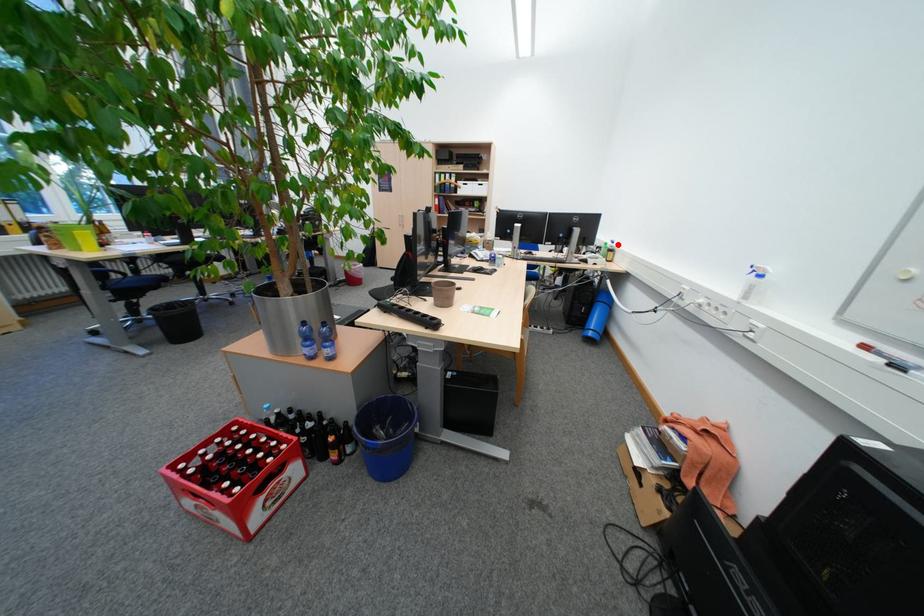
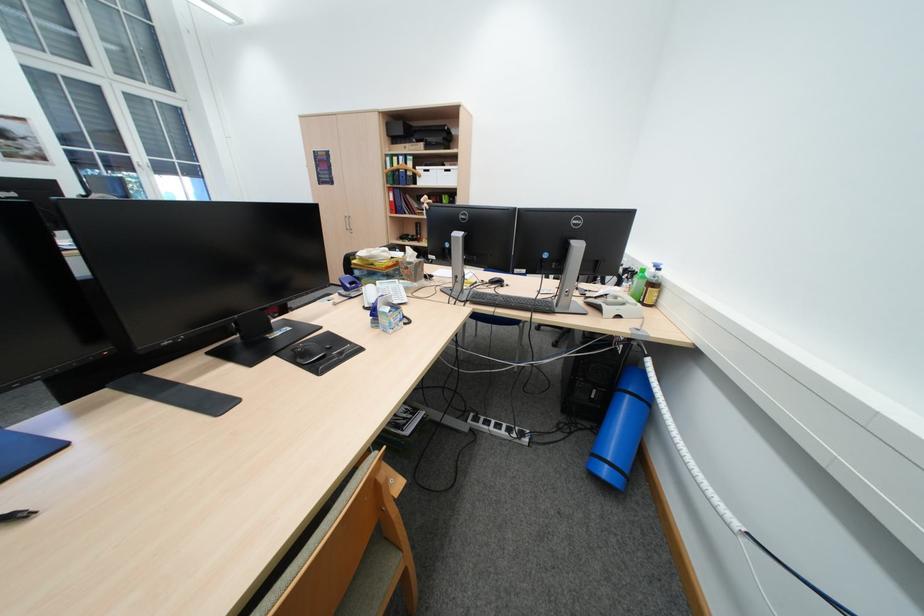
The point at the highlighted location is marked in the first image. Where is the corresponding point in the second image?

(655, 272)